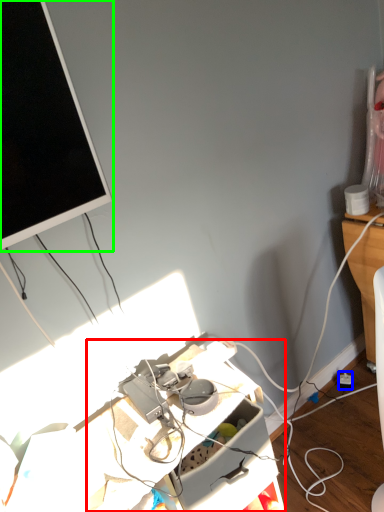
Question: Which object is the farthest from computer desk (highlighted by a red box)? Choose among these: power outlet (highlighted by a blue box) or television (highlighted by a green box).

Choices:
 (A) power outlet
 (B) television

Answer: (A)